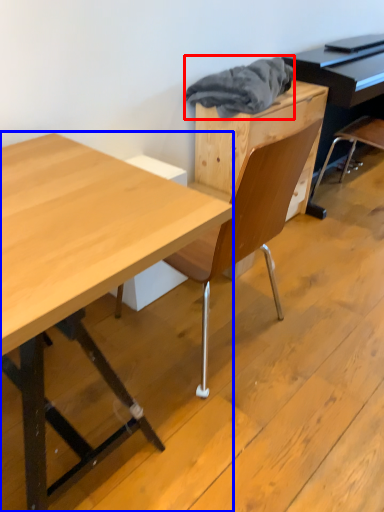
Question: Among these objects, which one is farthest to the camera, material (highlighted by a red box) or desk (highlighted by a blue box)?

Choices:
 (A) material
 (B) desk

Answer: (A)